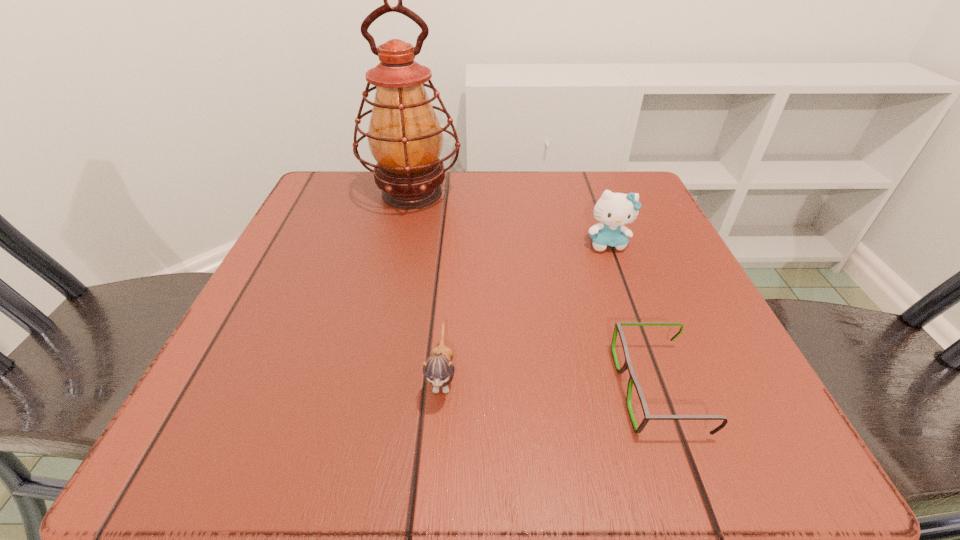
Identify which object is located as the nearest to the spectacles. Please provide its 2D coordinates. Your answer should be formatted as a tuple, i.e. [(x, y)], where the tuple contains the x and y coordinates of a point satisfying the conditions above.

[(614, 210)]

Identify the location of vacant space that satisfies the following two spatial constraints: 1. on the face of the second tallest object; 2. on the lens of the shortest object. (660, 389).

You are a GUI agent. You are given a task and a screenshot of the screen. Output one action in this format:
    pyautogui.click(x=<x>, y=<y>)
    Task: Click on the free spot that satisfies the following two spatial constraints: 1. on the face of the taller kitten; 2. on the lens of the spectacles
    The image size is (960, 540).
    Given the screenshot: What is the action you would take?
    pyautogui.click(x=660, y=389)

Identify the location of free spot that satisfies the following two spatial constraints: 1. on the face of the second tallest object; 2. on the lens of the spectacles. The width and height of the screenshot is (960, 540). (660, 389).

Where is `free spot that satisfies the following two spatial constraints: 1. on the face of the taller kitten; 2. on the lens of the spectacles`? This screenshot has width=960, height=540. free spot that satisfies the following two spatial constraints: 1. on the face of the taller kitten; 2. on the lens of the spectacles is located at coordinates (660, 389).